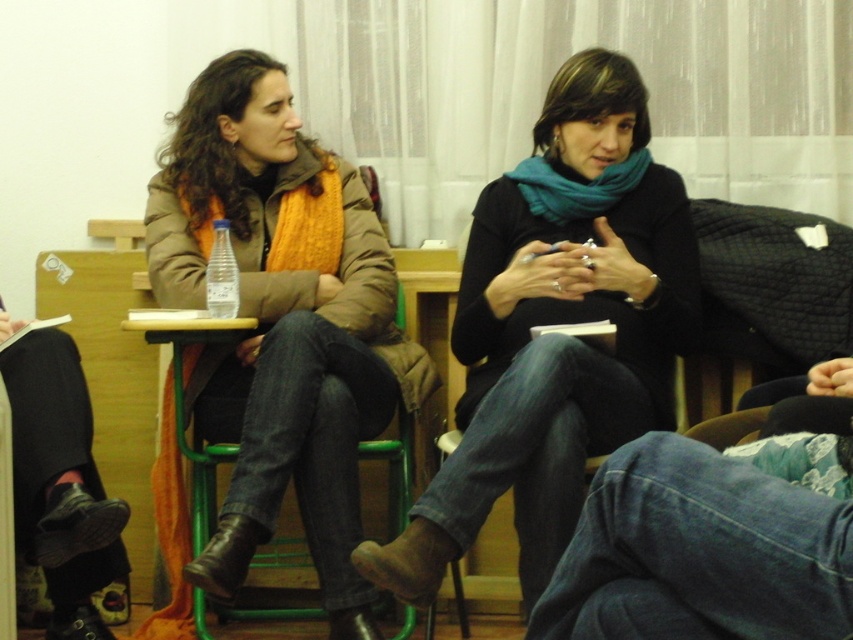
Does matte black sweater at center have a lesser height compared to clear plastic bottle at center?

No.

Between matte black sweater at center and clear plastic bottle at center, which one appears on the right side from the viewer's perspective?

matte black sweater at center

Who is more forward, [573,150] or [231,266]?

Positioned in front is point [231,266].

This screenshot has width=853, height=640. I want to click on matte black sweater at center, so click(x=555, y=323).

Can you confirm if green metal chair at center is bigger than teal soft scarf at center?

Yes, green metal chair at center is bigger than teal soft scarf at center.

Does point (206, 600) come farther from viewer compared to point (514, 170)?

Yes, point (206, 600) is farther from viewer.

I want to click on green metal chair at center, so [x=198, y=468].

What are the coordinates of `green metal chair at center` in the screenshot? It's located at (198, 468).

Is point (523, 531) behind point (643, 164)?

No.

Can you confirm if matte black sweater at center is shorter than teal soft scarf at center?

No, matte black sweater at center is not shorter than teal soft scarf at center.

Find the location of `matte black sweater at center`. matte black sweater at center is located at coordinates (555, 323).

I want to click on matte black sweater at center, so click(555, 323).